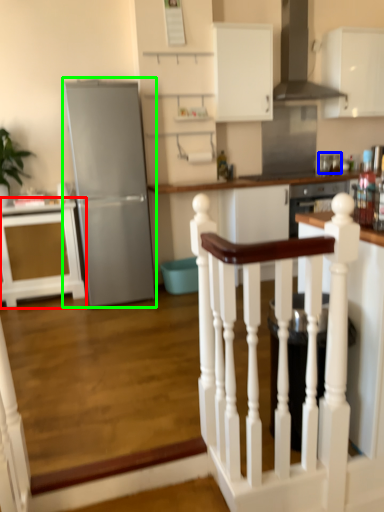
Question: Which object is positioned closest to cabinetry (highlighted by a red box)? Select from appliance (highlighted by a blue box) and refrigerator (highlighted by a green box).

Choices:
 (A) appliance
 (B) refrigerator

Answer: (B)